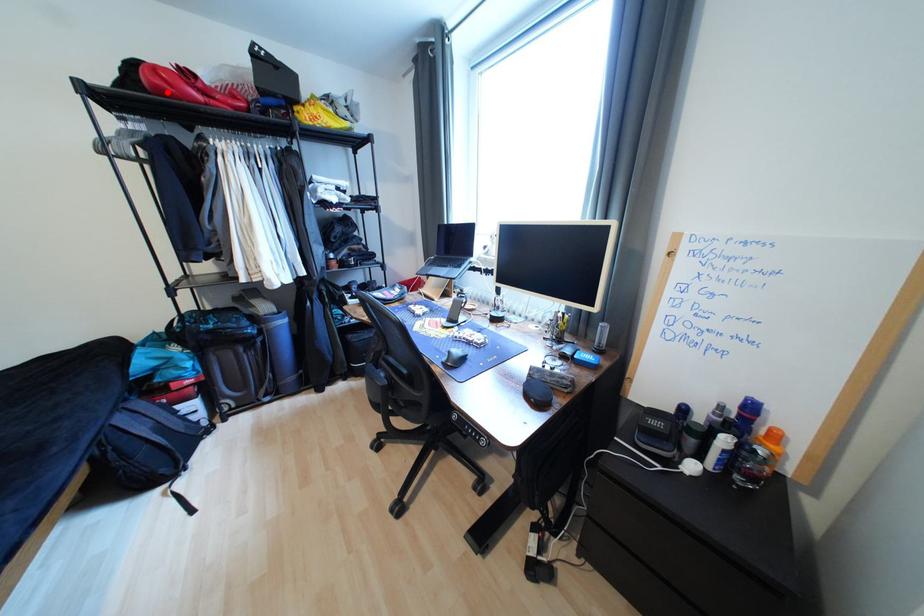
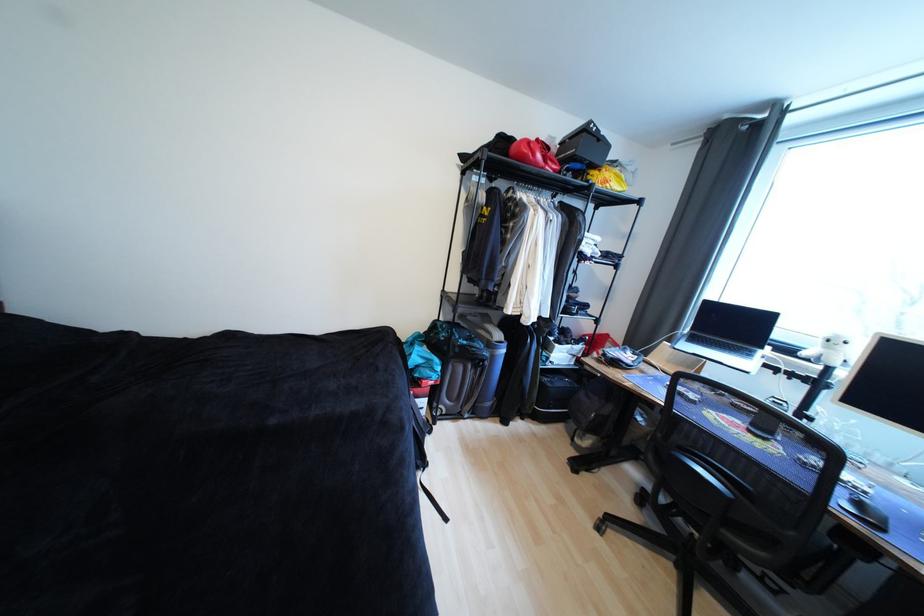
In the second image, find the point that corresponds to the highlighted location in the first image.

(529, 159)